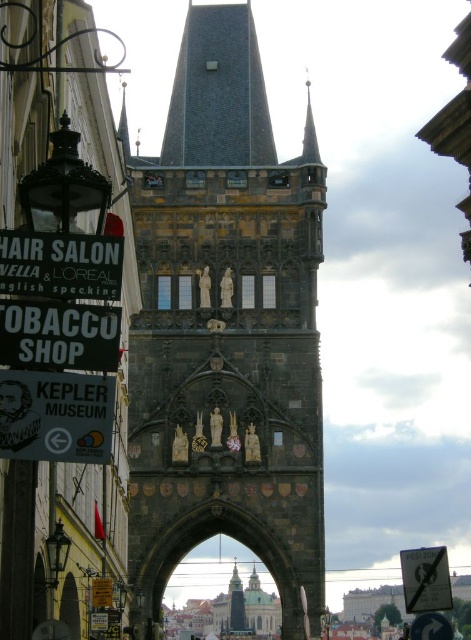
You are a tourist standing in front of the historic stone tower. You notice two signs near the base of the tower. Which sign, the white paper sign at lower left or the white plastic sign at lower right, is closer to you?

The white paper sign at lower left is closer to you because it is in front of the white plastic sign at lower right.

You are standing in a field and see the dark gray stone tower at center in the distance. If you were to walk directly towards it, which direction should you head?

The dark gray stone tower at center is located at point coordinates of (226, 332), which would mean you should head directly towards the center of the image to reach it.

Based on the photo, you are a tourist standing in front of the dark gray stone tower at center and the black plastic hair salon sign at upper left. Which object is located to the right side of the other?

The dark gray stone tower at center is positioned on the right side of black plastic hair salon sign at upper left, so the dark gray stone tower at center is to the right of the black plastic hair salon sign at upper left.